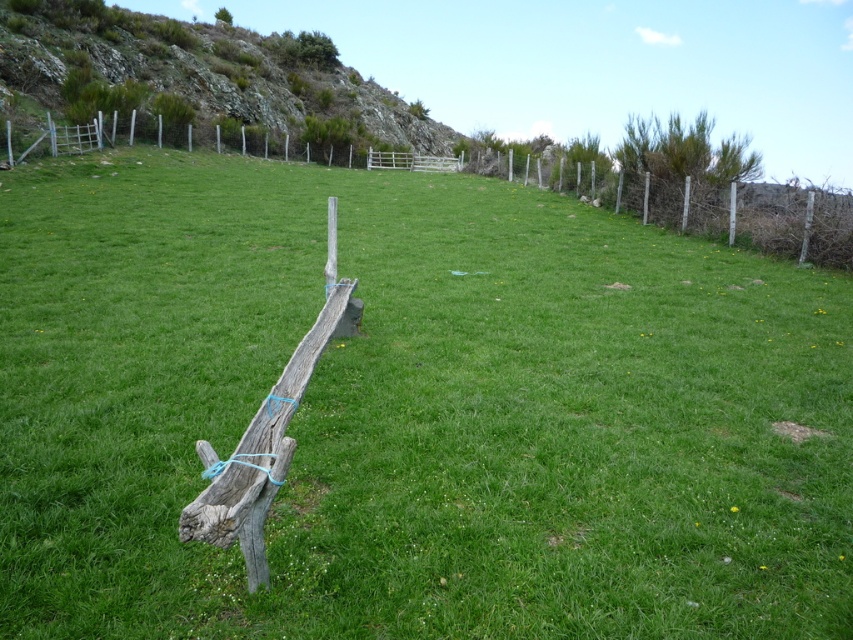
Who is more distant from viewer, (x=0, y=83) or (x=804, y=202)?

Positioned behind is point (x=0, y=83).

Between point (335, 65) and point (788, 253), which one is positioned in front?

Positioned in front is point (788, 253).

Locate an element on the screen. rough textured rock at upper left is located at coordinates (202, 74).